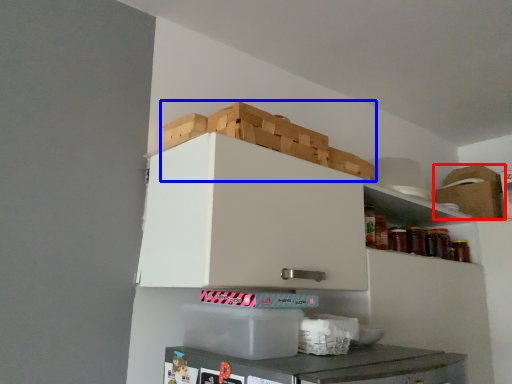
Question: Among these objects, which one is nearest to the camera, cardboard box (highlighted by a red box) or crate (highlighted by a blue box)?

Choices:
 (A) cardboard box
 (B) crate

Answer: (B)